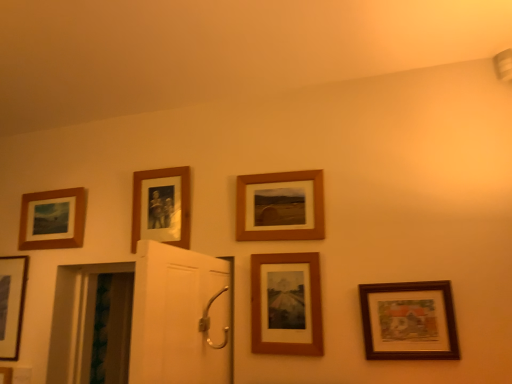
Question: Can you confirm if wooden photo frame at upper center, which ranks as the third picture frame in left-to-right order, is thinner than matte black picture frame at lower left, the 6th picture frame positioned from the right?

Choices:
 (A) yes
 (B) no

Answer: (B)

Question: Is wooden photo frame at upper center, which ranks as the third picture frame in left-to-right order, oriented towards matte black picture frame at lower left, the 1th picture frame from the left?

Choices:
 (A) no
 (B) yes

Answer: (A)

Question: Would you consider wooden photo frame at upper center, which ranks as the third picture frame in left-to-right order, to be distant from matte black picture frame at lower left, the 6th picture frame positioned from the right?

Choices:
 (A) yes
 (B) no

Answer: (B)

Question: Considering the relative positions of wooden photo frame at upper center, which ranks as the third picture frame in left-to-right order, and matte black picture frame at lower left, the 1th picture frame from the left, in the image provided, is wooden photo frame at upper center, which ranks as the third picture frame in left-to-right order, to the left of matte black picture frame at lower left, the 1th picture frame from the left, from the viewer's perspective?

Choices:
 (A) yes
 (B) no

Answer: (B)

Question: Is wooden photo frame at upper center, arranged as the 4th picture frame when viewed from the right, positioned in front of matte black picture frame at lower left, the 1th picture frame from the left?

Choices:
 (A) yes
 (B) no

Answer: (A)

Question: Would you say wooden photo frame at upper center, arranged as the 4th picture frame when viewed from the right, contains matte black picture frame at lower left, the 1th picture frame from the left?

Choices:
 (A) no
 (B) yes

Answer: (A)

Question: Can you confirm if matte wood picture frame at upper left, which is the 2th picture frame in left-to-right order, is positioned to the left of wooden framed print at center, placed as the second picture frame when sorted from right to left?

Choices:
 (A) no
 (B) yes

Answer: (B)

Question: Is matte wood picture frame at upper left, which is counted as the fifth picture frame, starting from the right, directly adjacent to wooden framed print at center, which is the 5th picture frame in left-to-right order?

Choices:
 (A) no
 (B) yes

Answer: (A)

Question: Would you say matte wood picture frame at upper left, which is the 2th picture frame in left-to-right order, is outside wooden framed print at center, which is the 5th picture frame in left-to-right order?

Choices:
 (A) yes
 (B) no

Answer: (A)

Question: From a real-world perspective, is matte wood picture frame at upper left, which is the 2th picture frame in left-to-right order, over wooden framed print at center, placed as the second picture frame when sorted from right to left?

Choices:
 (A) yes
 (B) no

Answer: (A)

Question: Is matte wood picture frame at upper left, which is the 2th picture frame in left-to-right order, at the right side of wooden framed print at center, which is the 5th picture frame in left-to-right order?

Choices:
 (A) yes
 (B) no

Answer: (B)

Question: Is matte wood picture frame at upper left, which is the 2th picture frame in left-to-right order, bigger than wooden framed print at center, placed as the second picture frame when sorted from right to left?

Choices:
 (A) no
 (B) yes

Answer: (B)

Question: Considering the relative sizes of matte black picture frame at lower left, the 6th picture frame positioned from the right, and wooden picture frame at lower right, acting as the 1th picture frame starting from the right, in the image provided, is matte black picture frame at lower left, the 6th picture frame positioned from the right, bigger than wooden picture frame at lower right, acting as the 1th picture frame starting from the right,?

Choices:
 (A) no
 (B) yes

Answer: (B)